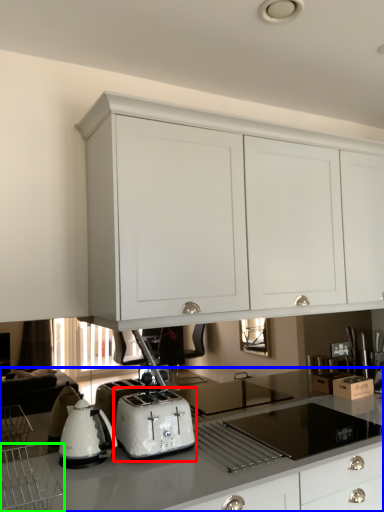
Question: Which object is the closest to the toaster (highlighted by a red box)? Choose among these: countertop (highlighted by a blue box) or kitchen appliance (highlighted by a green box).

Choices:
 (A) countertop
 (B) kitchen appliance

Answer: (A)